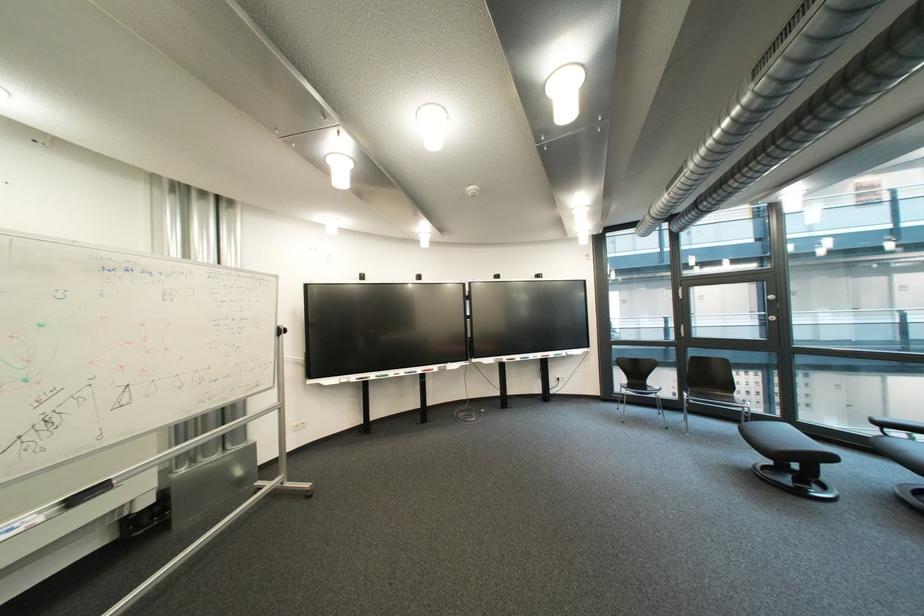
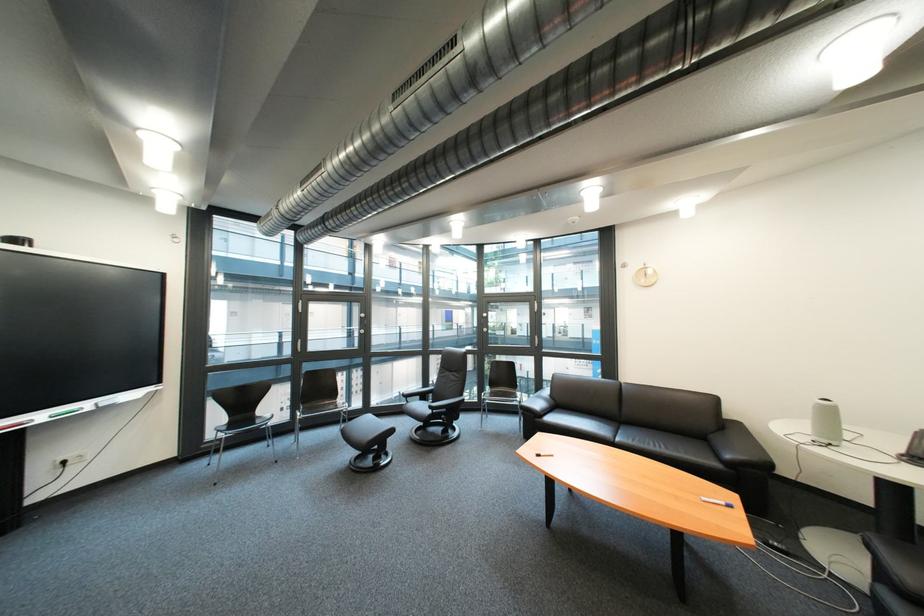
In the second image, find the point that corresponds to point (577, 354) in the first image.

(101, 406)